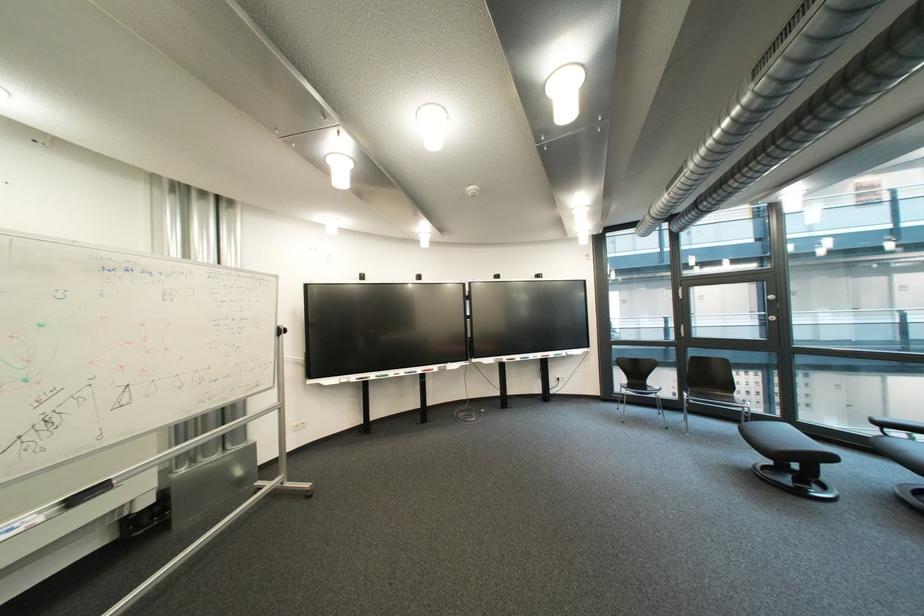
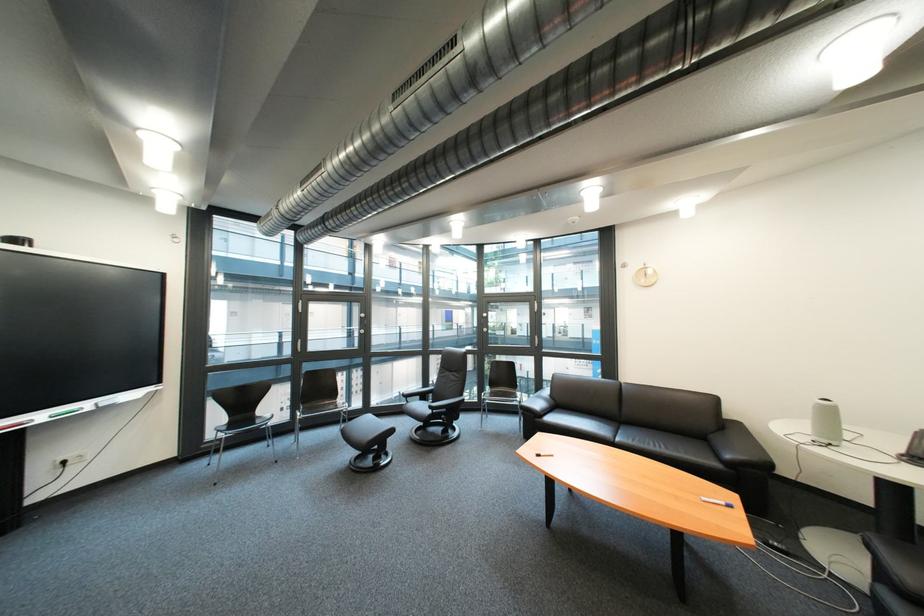
In the second image, find the point that corresponds to point (577, 354) in the first image.

(101, 406)